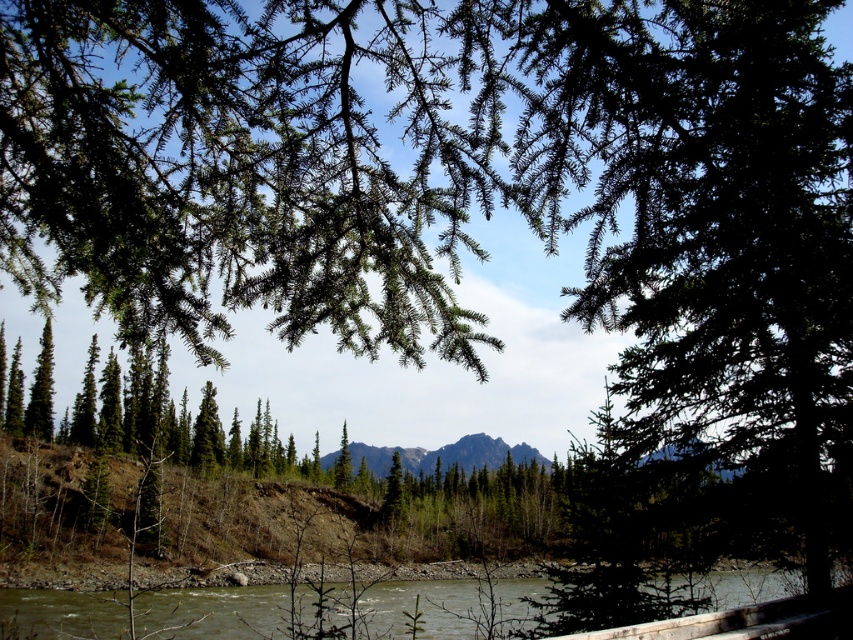
Does brown gravel river at lower center have a lesser height compared to rugged granite mountain at center?

In fact, brown gravel river at lower center may be taller than rugged granite mountain at center.

Does brown gravel river at lower center have a lesser width compared to rugged granite mountain at center?

No.

Is point (500, 604) more distant than point (525, 444)?

No, it is in front of (525, 444).

I want to click on brown gravel river at lower center, so click(x=314, y=611).

Can you confirm if rugged granite mountain at center is wider than green matte evergreen tree at lower left?

Yes.

Looking at this image, measure the distance between rugged granite mountain at center and green matte evergreen tree at lower left.

The distance of rugged granite mountain at center from green matte evergreen tree at lower left is 215.81 feet.

Is point (474, 467) positioned after point (48, 404)?

Yes.

Locate an element on the screen. rugged granite mountain at center is located at coordinates (445, 456).

Between brown gravel river at lower center and green matte tree at center, which one is positioned higher?

brown gravel river at lower center is higher up.

How far apart are brown gravel river at lower center and green matte tree at center?

148.20 feet

What do you see at coordinates (314, 611) in the screenshot? Image resolution: width=853 pixels, height=640 pixels. I see `brown gravel river at lower center` at bounding box center [314, 611].

Locate an element on the screen. brown gravel river at lower center is located at coordinates (314, 611).